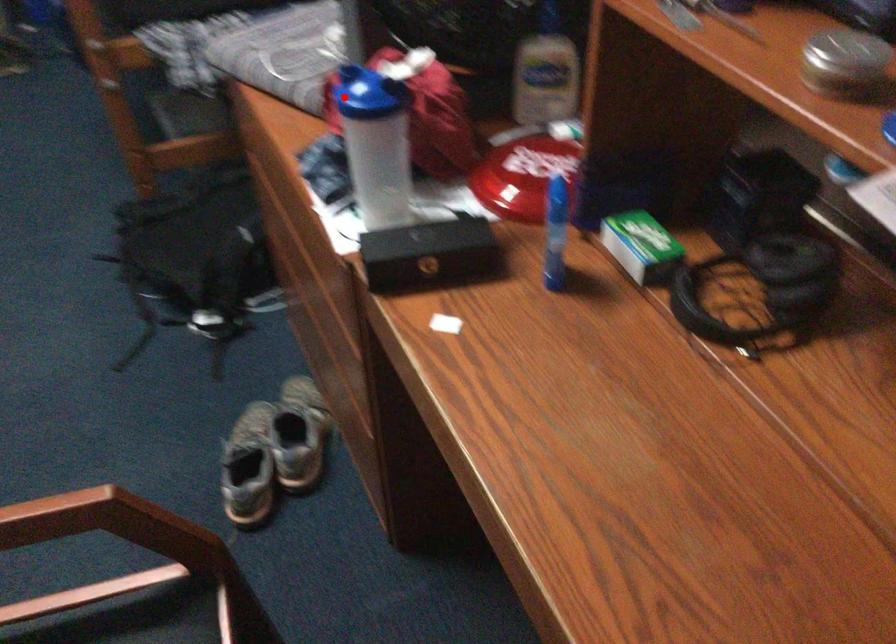
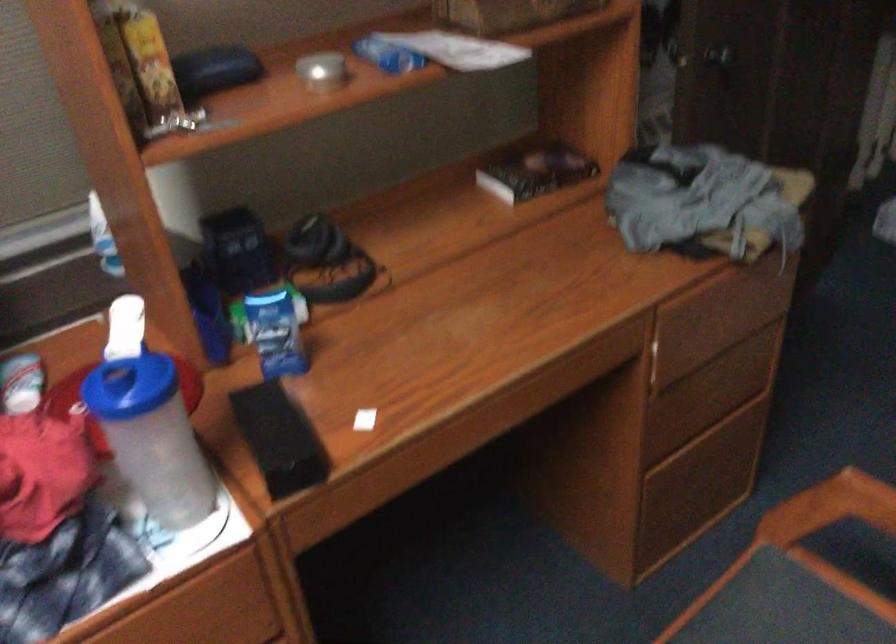
Question: I am providing you with two images of the same scene from different viewpoints. Image1 has a red point marked. In image2, the corresponding 3D location appears at what relative position? Reply with the corresponding letter.

Choices:
 (A) Closer
 (B) Farther

Answer: (A)